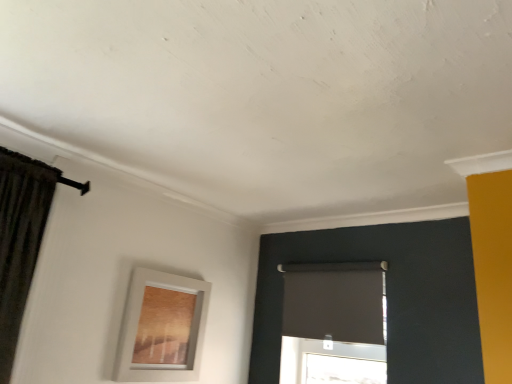
Question: Considering the positions of white matte picture frame at lower left and matte black roller shade at center in the image, is white matte picture frame at lower left taller or shorter than matte black roller shade at center?

Choices:
 (A) tall
 (B) short

Answer: (A)

Question: Does point (130, 375) appear closer or farther from the camera than point (360, 291)?

Choices:
 (A) farther
 (B) closer

Answer: (B)

Question: Visually, is white matte picture frame at lower left positioned to the left or to the right of matte black roller shade at center?

Choices:
 (A) right
 (B) left

Answer: (B)

Question: From the image's perspective, is matte black roller shade at center located above or below white matte picture frame at lower left?

Choices:
 (A) below
 (B) above

Answer: (B)

Question: Does point (379, 354) appear closer or farther from the camera than point (183, 372)?

Choices:
 (A) farther
 (B) closer

Answer: (B)

Question: Looking at their shapes, would you say matte black roller shade at center is wider or thinner than white matte picture frame at lower left?

Choices:
 (A) thin
 (B) wide

Answer: (A)

Question: Is matte black roller shade at center inside the boundaries of white matte picture frame at lower left, or outside?

Choices:
 (A) outside
 (B) inside

Answer: (A)